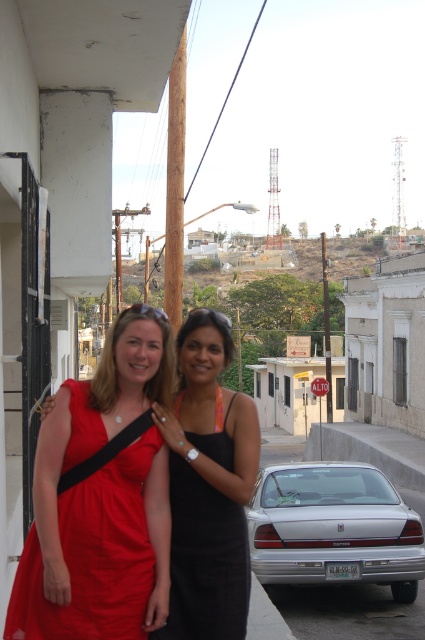
You are a photographer trying to capture a closeup of the matte red dress at center. Based on its position coordinates, would you need to move left or right to frame it properly?

The matte red dress at center is located at point 0.759 on the x axis, which is to the right of the center point. Therefore, you should move to the left to frame it properly.

You are a photographer trying to capture a clear shot of the silver metallic sedan at lower center. However, the matte red dress at left is blocking your view. Can you move around to the right side of the sedan to get an unobstructed view?

The matte red dress at left is in front of the silver metallic sedan at lower center, so moving to the right side of the sedan might allow you to avoid the obstruction caused by the dress and capture an unobstructed view of the sedan.